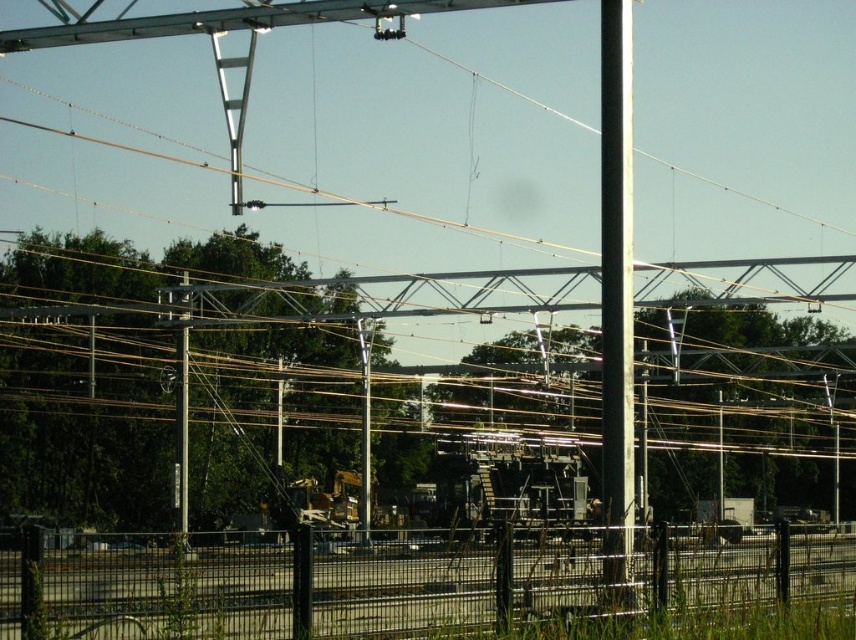
Question: Which object is closer to the camera taking this photo?

Choices:
 (A) white glossy pole at center
 (B) metallic gray pole at center
 (C) black wire mesh fence at lower center

Answer: (C)

Question: Which object is positioned closest to the black wire mesh fence at lower center?

Choices:
 (A) metallic gray pole at center
 (B) white glossy pole at center

Answer: (B)

Question: Does black wire mesh fence at lower center come behind metallic gray pole at center?

Choices:
 (A) yes
 (B) no

Answer: (B)

Question: Does black wire mesh fence at lower center have a larger size compared to metallic gray pole at left?

Choices:
 (A) yes
 (B) no

Answer: (B)

Question: Which point is farther to the camera?

Choices:
 (A) black wire mesh fence at lower center
 (B) metallic gray pole at left

Answer: (B)

Question: Can you confirm if black wire mesh fence at lower center is wider than metallic gray pole at left?

Choices:
 (A) yes
 (B) no

Answer: (A)